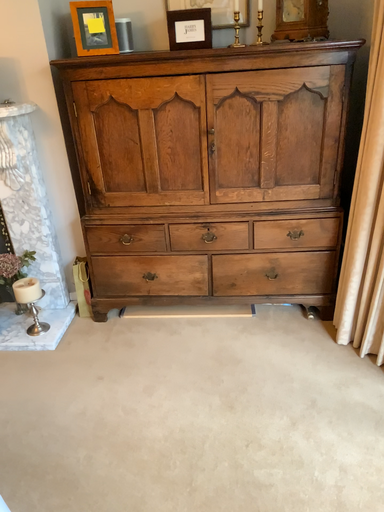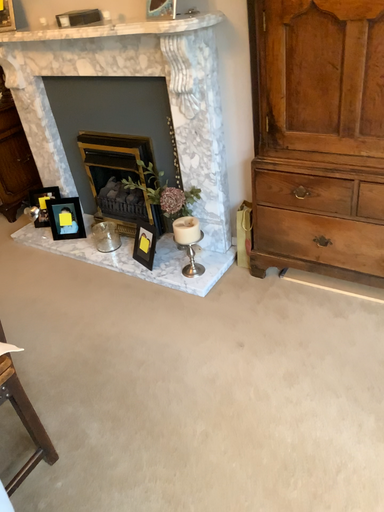
Question: How did the camera likely rotate when shooting the video?

Choices:
 (A) rotated upward
 (B) rotated downward

Answer: (B)